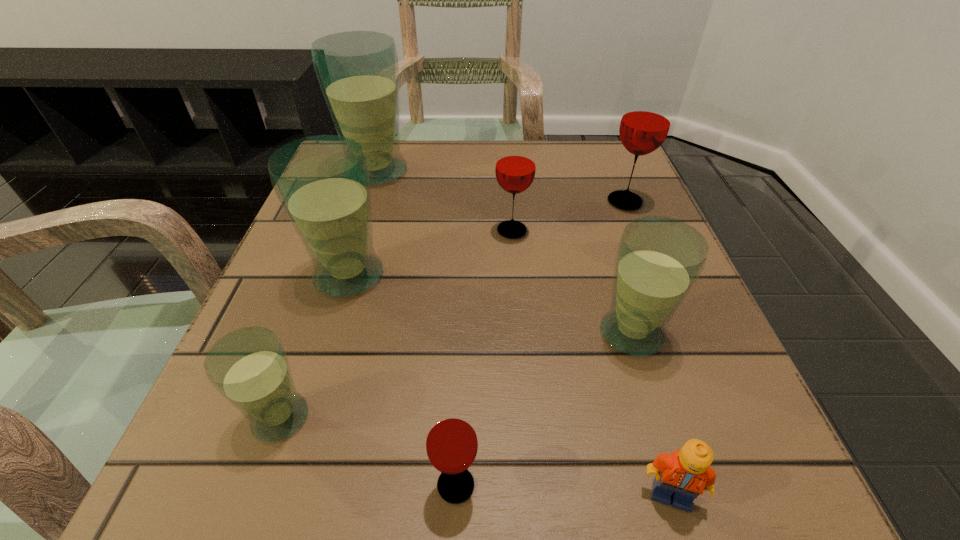
You are a GUI agent. You are given a task and a screenshot of the screen. Output one action in this format:
    pyautogui.click(x=<x>, y=<y>)
    Task: Click on the free space located on the left of the fifth farthest glass
    
    Given the screenshot: What is the action you would take?
    pyautogui.click(x=437, y=333)

The width and height of the screenshot is (960, 540). Find the location of `vacant space located 0.130m on the right of the nearest blue glass`. vacant space located 0.130m on the right of the nearest blue glass is located at coordinates (413, 417).

At what (x,y) coordinates should I click in order to perform the action: click on free point located 0.050m on the left of the smallest red glass. Please return your answer as a coordinate pair (x, y). Looking at the image, I should click on (389, 485).

Locate an element on the screen. Image resolution: width=960 pixels, height=540 pixels. Lego located in the near edge section of the desktop is located at coordinates (685, 474).

You are a GUI agent. You are given a task and a screenshot of the screen. Output one action in this format:
    pyautogui.click(x=<x>, y=<y>)
    Task: Click on the Lego present at the right edge
    This screenshot has height=540, width=960.
    Given the screenshot: What is the action you would take?
    pyautogui.click(x=685, y=474)

Find the location of a particular element. The image size is (960, 540). object situated at the far left corner is located at coordinates (358, 72).

You are a GUI agent. You are given a task and a screenshot of the screen. Output one action in this format:
    pyautogui.click(x=<x>, y=<y>)
    Task: Click on the object at the near left corner
    This screenshot has width=960, height=540.
    Given the screenshot: What is the action you would take?
    pyautogui.click(x=249, y=367)

Locate an element on the screen. Image resolution: width=960 pixels, height=540 pixels. object that is at the far right corner is located at coordinates (646, 119).

Identify the location of object that is at the near right corner. (685, 474).

Where is `free space at the far edge of the desktop`? free space at the far edge of the desktop is located at coordinates (411, 176).